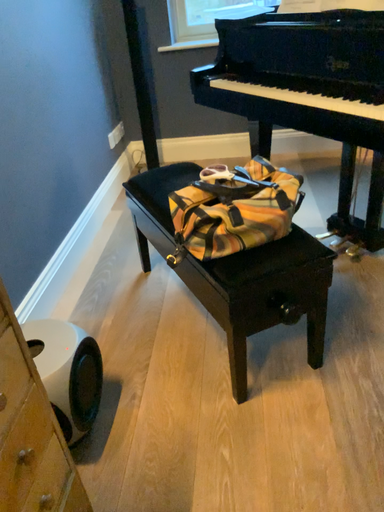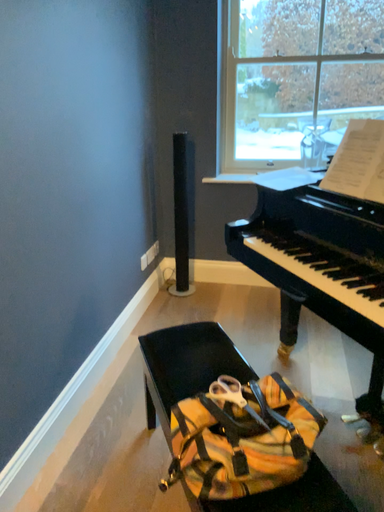
Question: Which way did the camera rotate in the video?

Choices:
 (A) rotated downward
 (B) rotated upward

Answer: (B)